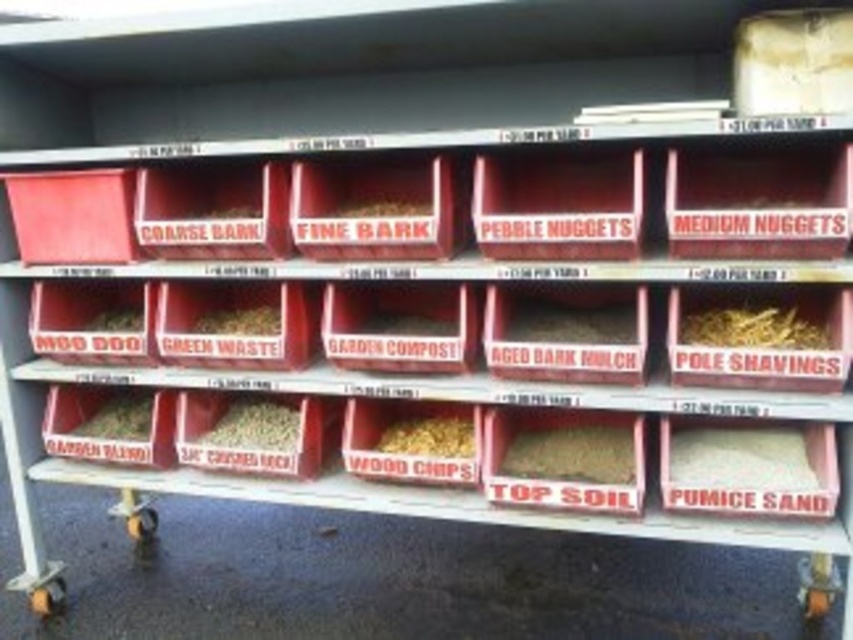
Does brown wood chips at center have a larger size compared to brown crumbly mulch at center?

No, brown wood chips at center is not bigger than brown crumbly mulch at center.

How distant is brown wood chips at center from brown crumbly mulch at center?

brown wood chips at center is 24.52 inches away from brown crumbly mulch at center.

Which is in front, point (430, 432) or point (115, 397)?

Positioned in front is point (430, 432).

Where is `brown wood chips at center`? The width and height of the screenshot is (853, 640). brown wood chips at center is located at coordinates (428, 436).

Can you confirm if yellow shredded wood at center right is bigger than brown textured mulch at center?

No, yellow shredded wood at center right is not bigger than brown textured mulch at center.

Does point (750, 312) come in front of point (222, 420)?

Yes, point (750, 312) is in front of point (222, 420).

Locate an element on the screen. yellow shredded wood at center right is located at coordinates pyautogui.click(x=753, y=326).

Which is above, brown mulch at center or brown textured mulch at center?

brown mulch at center is above.

Find the location of `brown mulch at center`. brown mulch at center is located at coordinates (572, 323).